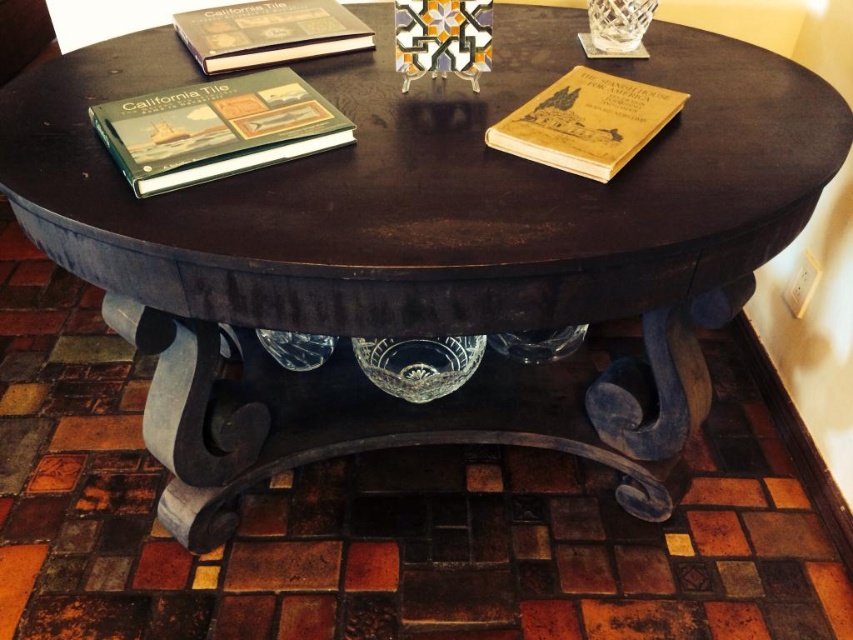
Does yellow paper book at upper right have a larger size compared to hardcover book at upper left?

No.

Which is behind, point (520, 115) or point (180, 12)?

The point (180, 12) is behind.

Is point (633, 120) behind point (241, 45)?

No, (633, 120) is closer to viewer.

Where is `yellow paper book at upper right`? The height and width of the screenshot is (640, 853). yellow paper book at upper right is located at coordinates (585, 122).

Does green matte book at upper left have a lesser width compared to hardcover book at upper left?

Yes.

Who is positioned more to the left, green matte book at upper left or hardcover book at upper left?

hardcover book at upper left

Does point (341, 118) come behind point (265, 6)?

No, (341, 118) is closer to viewer.

In order to click on green matte book at upper left in this screenshot , I will do `click(216, 129)`.

Is point (219, 104) less distant than point (492, 140)?

No, it is not.

The image size is (853, 640). I want to click on green matte book at upper left, so click(216, 129).